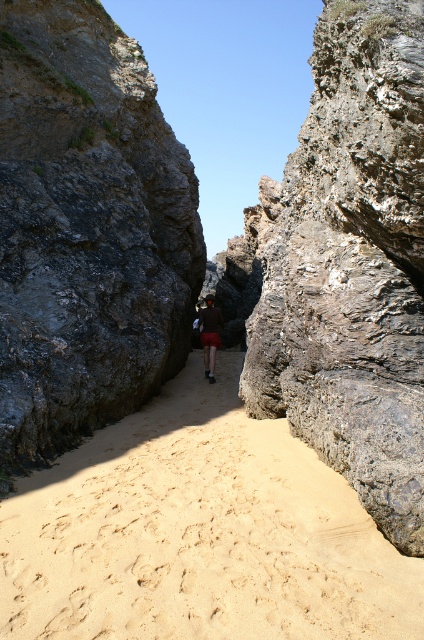
Is rough gray rock at center thinner than dark brown leather jacket at center?

No.

Identify the location of rough gray rock at center. (351, 266).

I want to click on rough gray rock at center, so click(351, 266).

In the scene shown: Which of these two, dark gray rocky cliff at center or rough gray rock at center, stands shorter?

rough gray rock at center is shorter.

Which is in front, point (39, 243) or point (404, 12)?

Point (404, 12)

Where is `dark gray rocky cliff at center`? dark gray rocky cliff at center is located at coordinates (86, 230).

Can you confirm if beige sandy path at center is positioned to the right of dark gray rocky cliff at center?

Indeed, beige sandy path at center is positioned on the right side of dark gray rocky cliff at center.

Is point (22, 513) positioned behind point (153, 268)?

No.

Who is more distant from viewer, (x=111, y=584) or (x=183, y=300)?

Point (x=183, y=300)

The image size is (424, 640). What are the coordinates of `beige sandy path at center` in the screenshot? It's located at (198, 532).